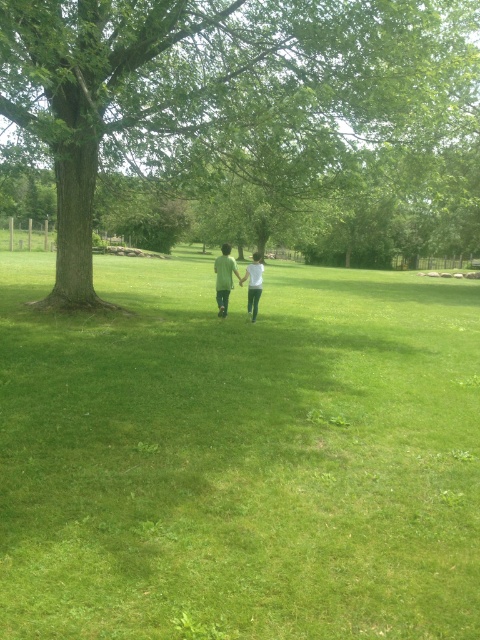
Question: Which object appears closest to the camera in this image?

Choices:
 (A) green matte shirt at center
 (B) matte green pants at center
 (C) white matte shirt at center

Answer: (B)

Question: Does matte green pants at center appear on the right side of white matte shirt at center?

Choices:
 (A) yes
 (B) no

Answer: (B)

Question: Considering the relative positions of green grassy field at center and white matte shirt at center in the image provided, where is green grassy field at center located with respect to white matte shirt at center?

Choices:
 (A) above
 (B) below

Answer: (B)

Question: Can you confirm if green grassy field at center is positioned above white matte shirt at center?

Choices:
 (A) no
 (B) yes

Answer: (A)

Question: Which object appears farthest from the camera in this image?

Choices:
 (A) white matte shirt at center
 (B) green matte shirt at center

Answer: (B)

Question: Which point is closer to the camera?

Choices:
 (A) (322, 388)
 (B) (229, 257)
 (C) (255, 288)

Answer: (A)